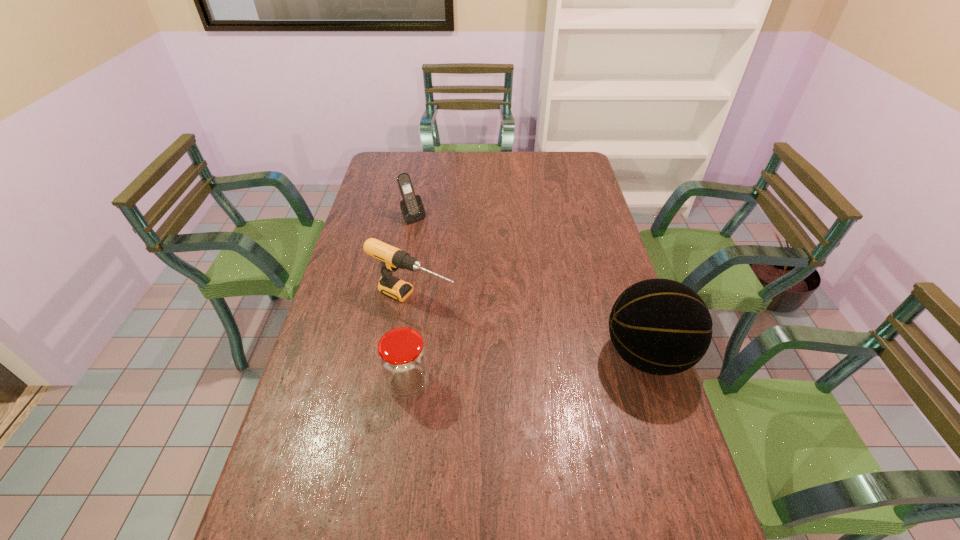
Image resolution: width=960 pixels, height=540 pixels. I want to click on blank area located on the front-facing side of the farthest object, so click(459, 265).

The height and width of the screenshot is (540, 960). In order to click on free space located on the front-facing side of the farthest object in this screenshot , I will do `click(470, 277)`.

Locate an element on the screen. free spot located 0.280m on the front-facing side of the farthest object is located at coordinates pos(459,265).

This screenshot has height=540, width=960. Identify the location of drill positioned at the left edge. (392, 258).

At what (x,y) coordinates should I click in order to perform the action: click on cellular telephone that is at the left edge. Please return your answer as a coordinate pair (x, y). Looking at the image, I should click on (411, 206).

Find the location of a particular element. Image resolution: width=960 pixels, height=540 pixels. object positioned at the right edge is located at coordinates (659, 326).

In the image, there is a desktop. Where is `vacant space at the far edge`? vacant space at the far edge is located at coordinates (415, 166).

The width and height of the screenshot is (960, 540). In the image, there is a desktop. What are the coordinates of `vacant region at the near edge` in the screenshot? It's located at (435, 513).

The height and width of the screenshot is (540, 960). I want to click on vacant space at the left edge of the desktop, so click(364, 212).

I want to click on blank area at the right edge, so point(597,266).